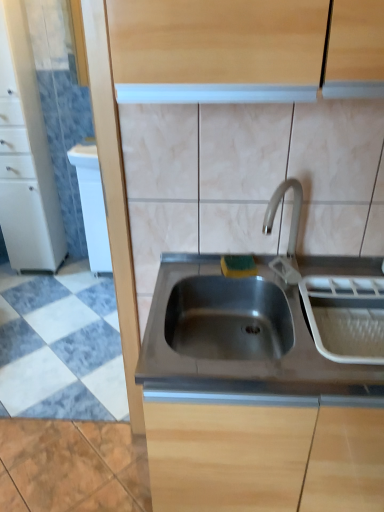
What are the coordinates of `space that is in front of white glossy cabinet at left, positioned as the second cabinetry in bottom-to-top order` in the screenshot? It's located at (28, 286).